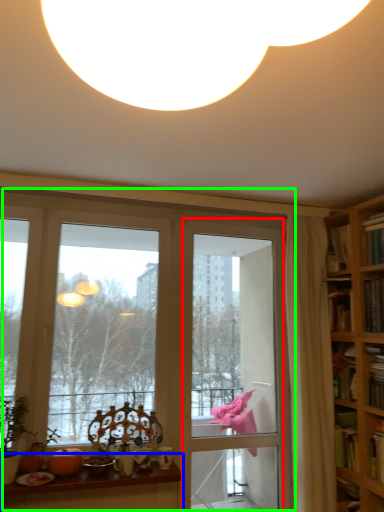
Question: Which is nearer to the screen door (highlighted by a red box)? table (highlighted by a blue box) or window (highlighted by a green box).

Choices:
 (A) table
 (B) window

Answer: (B)